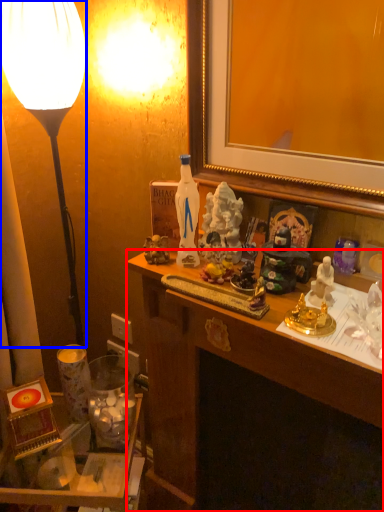
Question: Which point is further to the camera, desk (highlighted by a red box) or lamp (highlighted by a blue box)?

Choices:
 (A) desk
 (B) lamp

Answer: (B)